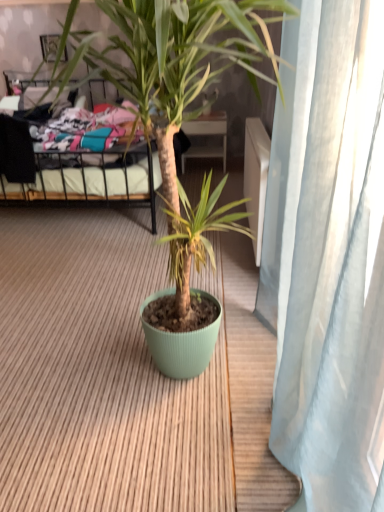
Question: From a real-world perspective, is metallic black bed at upper left located higher than matte green pot at center?

Choices:
 (A) no
 (B) yes

Answer: (A)

Question: Considering the relative positions of metallic black bed at upper left and matte green pot at center in the image provided, is metallic black bed at upper left behind matte green pot at center?

Choices:
 (A) no
 (B) yes

Answer: (B)

Question: From a real-world perspective, is metallic black bed at upper left beneath matte green pot at center?

Choices:
 (A) no
 (B) yes

Answer: (B)

Question: Is metallic black bed at upper left smaller than matte green pot at center?

Choices:
 (A) yes
 (B) no

Answer: (B)

Question: From the image's perspective, does metallic black bed at upper left appear lower than matte green pot at center?

Choices:
 (A) no
 (B) yes

Answer: (A)

Question: From the image's perspective, is matte green pot at center located above or below metallic black bed at upper left?

Choices:
 (A) above
 (B) below

Answer: (B)

Question: Do you think matte green pot at center is within metallic black bed at upper left, or outside of it?

Choices:
 (A) outside
 (B) inside

Answer: (A)

Question: Is point (167, 145) closer or farther from the camera than point (43, 180)?

Choices:
 (A) farther
 (B) closer

Answer: (B)

Question: In the image, is matte green pot at center positioned in front of or behind metallic black bed at upper left?

Choices:
 (A) behind
 (B) front

Answer: (B)

Question: From a real-world perspective, is metallic black bed at upper left physically located above or below matte green pot at center?

Choices:
 (A) above
 (B) below

Answer: (B)

Question: Looking at their shapes, would you say metallic black bed at upper left is wider or thinner than matte green pot at center?

Choices:
 (A) wide
 (B) thin

Answer: (A)

Question: Considering the relative positions of metallic black bed at upper left and matte green pot at center in the image provided, is metallic black bed at upper left to the left or to the right of matte green pot at center?

Choices:
 (A) left
 (B) right

Answer: (A)

Question: Is metallic black bed at upper left in front of or behind matte green pot at center in the image?

Choices:
 (A) behind
 (B) front

Answer: (A)

Question: From the image's perspective, is metallic black bed at upper left located above or below matte black picture frame at upper left?

Choices:
 (A) below
 (B) above

Answer: (A)

Question: Considering their positions, is metallic black bed at upper left located in front of or behind matte black picture frame at upper left?

Choices:
 (A) front
 (B) behind

Answer: (A)